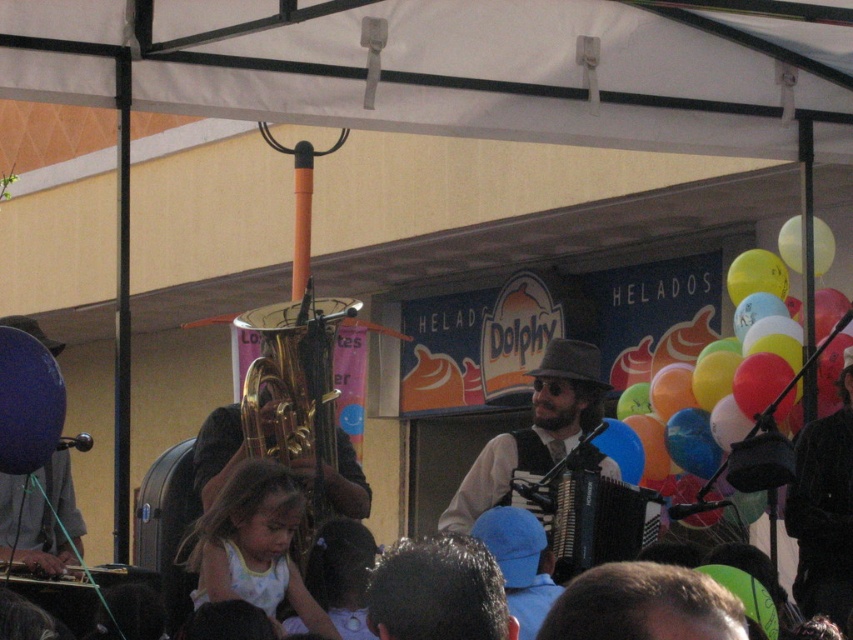
Question: Is gold brass trumpet at center further to camera compared to light brown hair at lower center?

Choices:
 (A) yes
 (B) no

Answer: (A)

Question: Considering the real-world distances, which object is closest to the yellow matte balloon at upper right?

Choices:
 (A) dark brown hair at center
 (B) light brown hair at lower center
 (C) blue matte balloon at left

Answer: (B)

Question: Is the position of gold brass trumpet at center more distant than that of matte black hat at center?

Choices:
 (A) yes
 (B) no

Answer: (A)

Question: Which is nearer to the matte black hat at center?

Choices:
 (A) dark brown hair at center
 (B) gold brass trumpet at center
 (C) light brown hair at lower center
 (D) multicolored balloons at right

Answer: (D)

Question: Among these objects, which one is farthest from the camera?

Choices:
 (A) multicolored balloons at right
 (B) dark brown hair at center
 (C) yellow matte balloon at upper right
 (D) light brown hair at lower center

Answer: (C)

Question: Does matte brown hat at center have a larger size compared to yellow matte balloon at upper right?

Choices:
 (A) no
 (B) yes

Answer: (B)